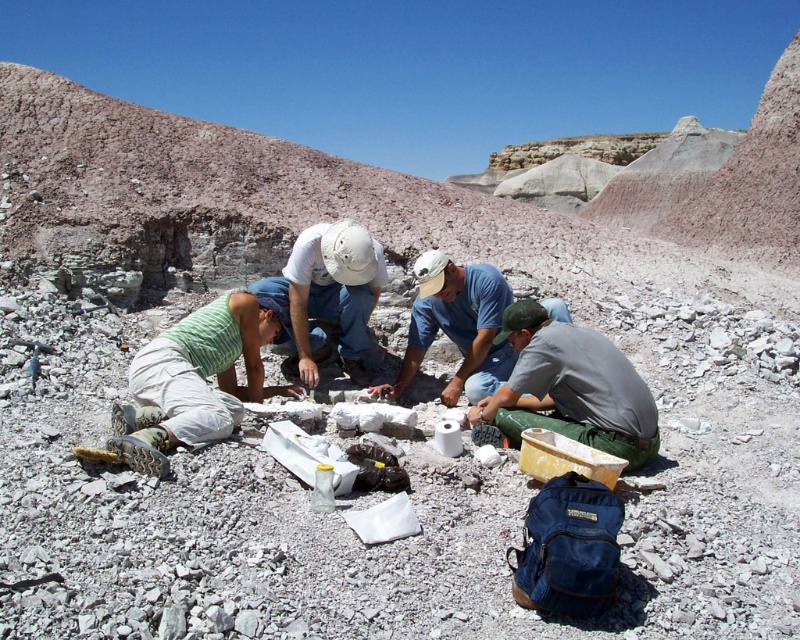
Does point (252, 388) lie behind point (432, 284)?

That is False.

Is green striped tank top at lower left positioned at the back of gray cotton shirt at center?

No, it is in front of gray cotton shirt at center.

Who is more distant from viewer, [222,328] or [486,298]?

The point [486,298] is more distant.

Identify the location of green striped tank top at lower left. The image size is (800, 640). (193, 381).

Which is more to the right, gray matte shirt at center or white matte helmet at center?

From the viewer's perspective, gray matte shirt at center appears more on the right side.

Is gray matte shirt at center further to the viewer compared to white matte helmet at center?

That is False.

Describe the element at coordinates (570, 387) in the screenshot. I see `gray matte shirt at center` at that location.

The width and height of the screenshot is (800, 640). What are the coordinates of `gray matte shirt at center` in the screenshot? It's located at (570, 387).

Can you confirm if gray matte shirt at center is smaller than gray cotton shirt at center?

Correct, gray matte shirt at center occupies less space than gray cotton shirt at center.

Describe the element at coordinates (570, 387) in the screenshot. I see `gray matte shirt at center` at that location.

Find the location of a particular element. The height and width of the screenshot is (640, 800). gray matte shirt at center is located at coordinates (570, 387).